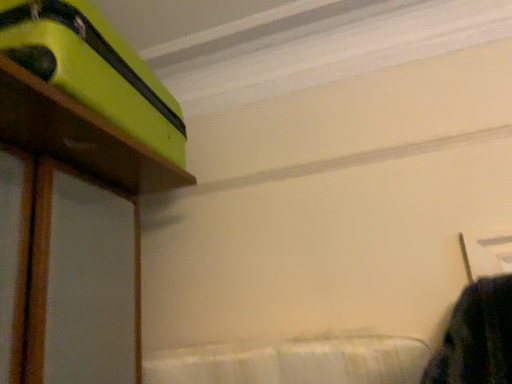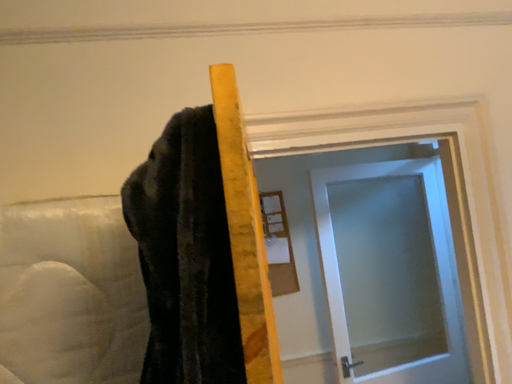
Question: Which way did the camera rotate in the video?

Choices:
 (A) rotated left
 (B) rotated right

Answer: (B)